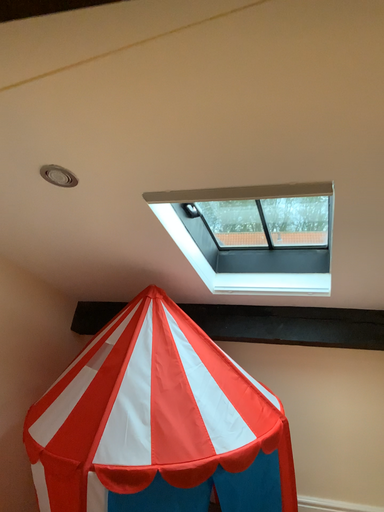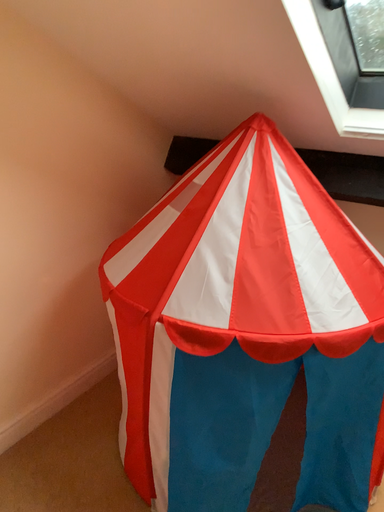
Question: How did the camera likely rotate when shooting the video?

Choices:
 (A) rotated right
 (B) rotated left

Answer: (B)